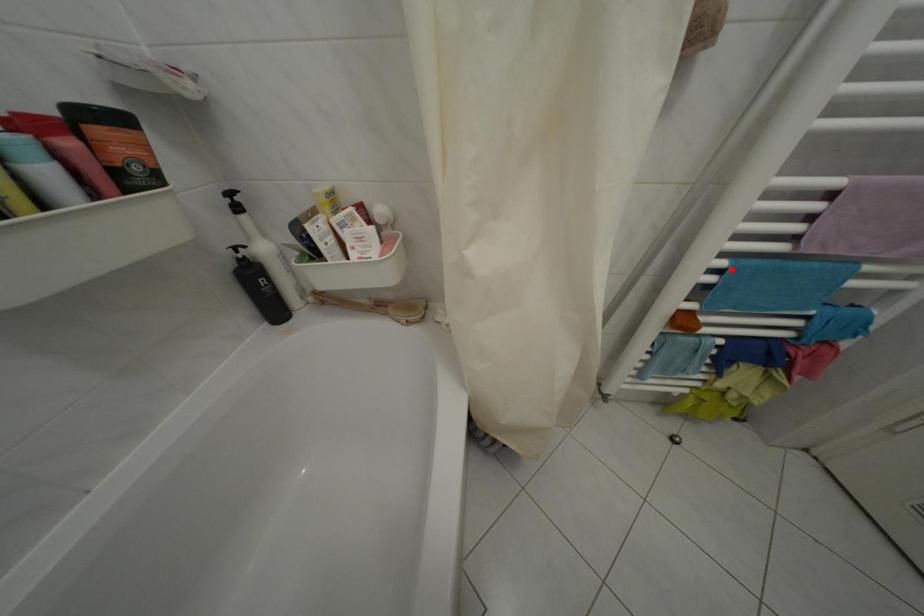
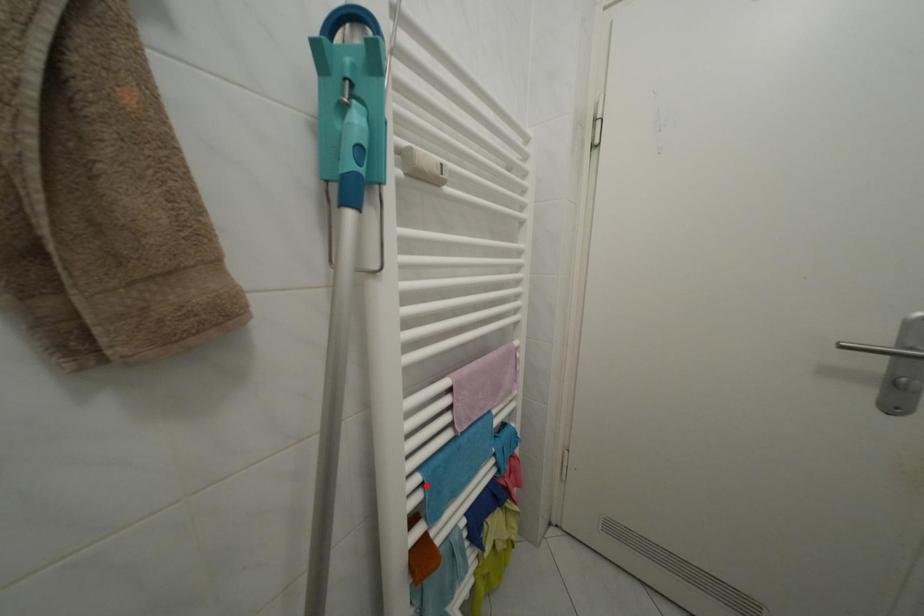
I am providing you with two images of the same scene from different viewpoints. A red point is marked on the first image and another point is marked on the second image. Are the points marked in image1 and image2 representing the same 3D position?

Yes